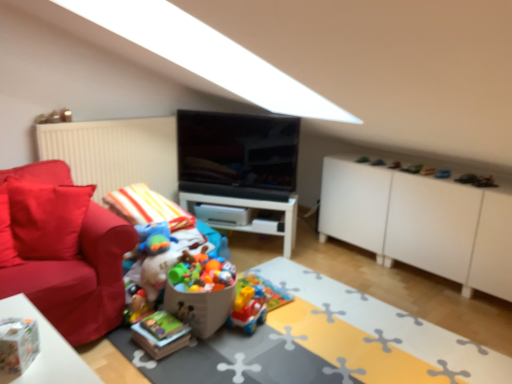
Locate an element on the screen. Image resolution: width=512 pixels, height=384 pixels. free space in front of plastic colorful toy car at center, positioned as the 2th toy in left-to-right order is located at coordinates (250, 338).